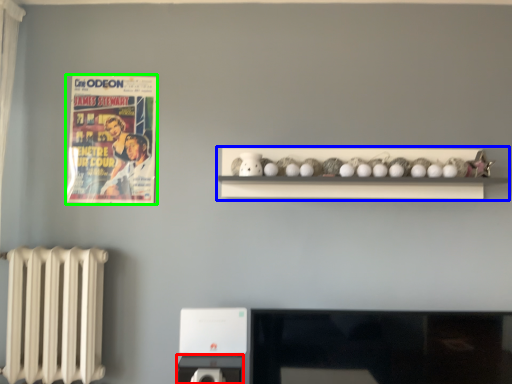
Question: Based on their relative distances, which object is nearer to appliance (highlighted by a red box)? Choose from shelf (highlighted by a blue box) and comic book (highlighted by a green box).

Choices:
 (A) shelf
 (B) comic book

Answer: (A)